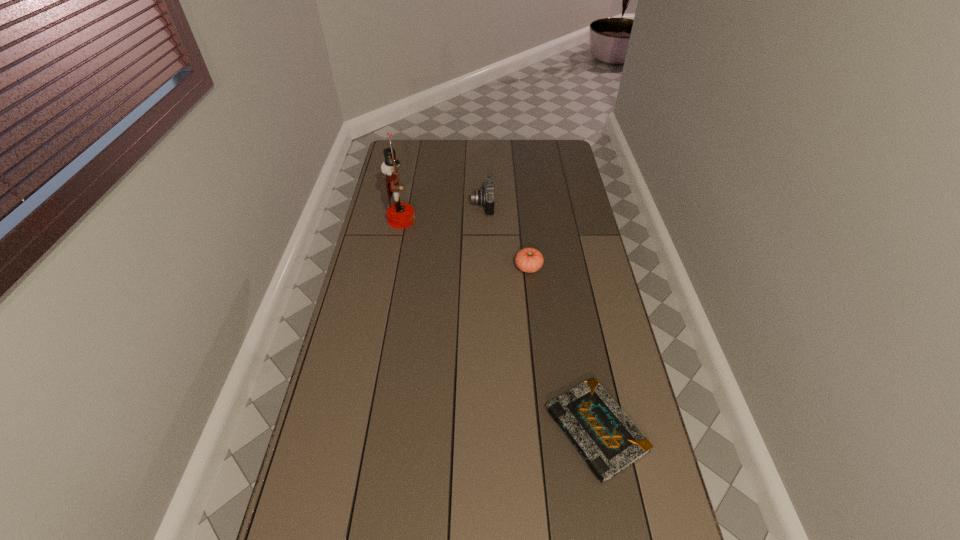
I want to click on free space located 0.390m on the front-facing side of the second tallest object, so click(x=382, y=205).

The height and width of the screenshot is (540, 960). In order to click on free space located on the front-facing side of the second tallest object in this screenshot , I will do `click(405, 205)`.

Locate an element on the screen. This screenshot has height=540, width=960. vacant position located on the front of the second shortest object is located at coordinates (536, 337).

Find the location of a particular element. The width and height of the screenshot is (960, 540). blank space located 0.250m on the left of the shortest object is located at coordinates (457, 430).

Locate an element on the screen. The height and width of the screenshot is (540, 960). object present at the left edge is located at coordinates (400, 215).

In order to click on object situated at the right edge in this screenshot , I will do `click(607, 439)`.

Locate an element on the screen. The height and width of the screenshot is (540, 960). free space at the far edge is located at coordinates (503, 165).

This screenshot has width=960, height=540. Identify the location of vacant space at the left edge of the desktop. (417, 168).

The width and height of the screenshot is (960, 540). In the image, there is a desktop. In order to click on blank space at the right edge in this screenshot , I will do `click(583, 237)`.

I want to click on free space between the camera and the second shortest object, so click(506, 236).